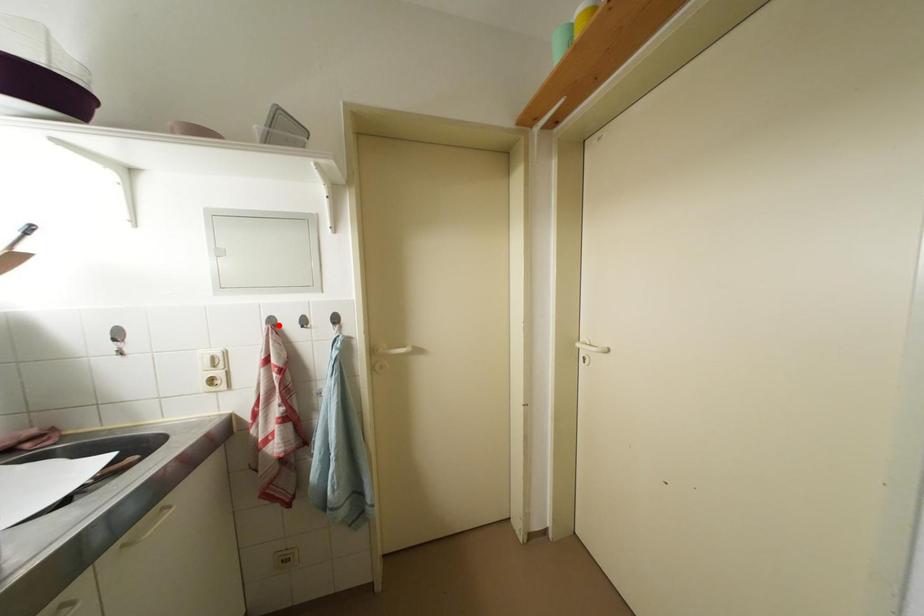
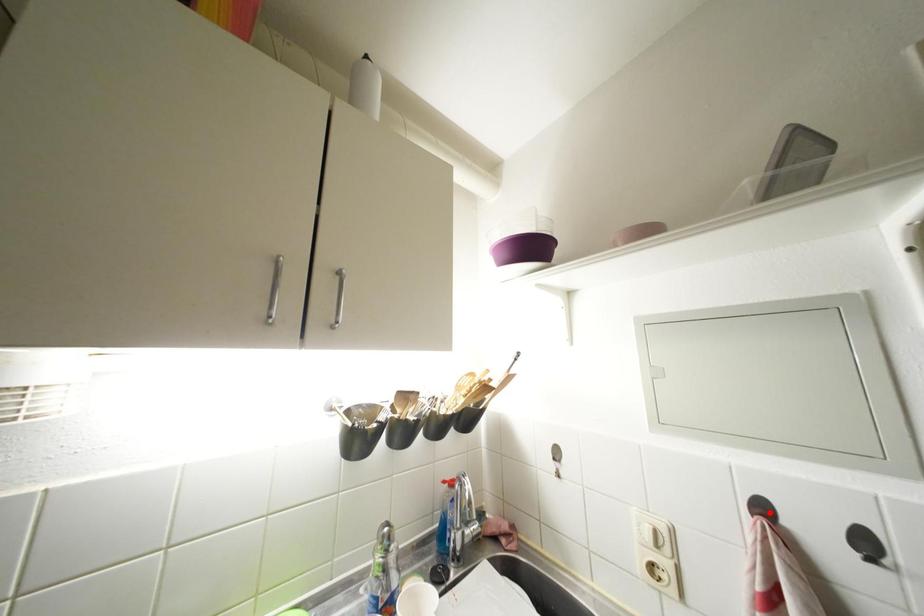
I am providing you with two images of the same scene from different viewpoints. A red point is marked on the first image and another point is marked on the second image. Does the point marked in image1 correspond to the same location as the one in image2?

Yes